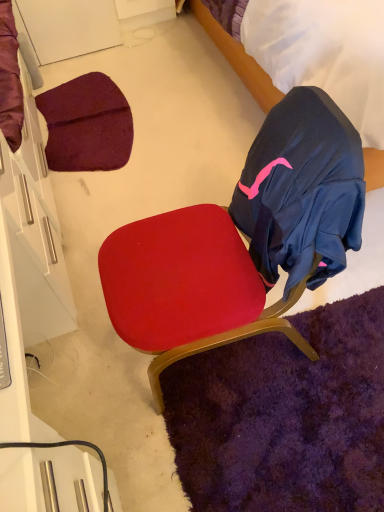
Question: Is velvet blue bed at upper right next to velvet red chair at center?

Choices:
 (A) yes
 (B) no

Answer: (B)

Question: From a real-world perspective, is velvet blue bed at upper right positioned under velvet red chair at center based on gravity?

Choices:
 (A) no
 (B) yes

Answer: (A)

Question: Considering the relative positions of velvet blue bed at upper right and velvet red chair at center in the image provided, is velvet blue bed at upper right to the right of velvet red chair at center from the viewer's perspective?

Choices:
 (A) no
 (B) yes

Answer: (B)

Question: Can you confirm if velvet blue bed at upper right is shorter than velvet red chair at center?

Choices:
 (A) yes
 (B) no

Answer: (B)

Question: From the image's perspective, is velvet blue bed at upper right over velvet red chair at center?

Choices:
 (A) no
 (B) yes

Answer: (B)

Question: Is velvet blue bed at upper right positioned in front of velvet red chair at center?

Choices:
 (A) no
 (B) yes

Answer: (A)

Question: Is the depth of velvet red chair at center greater than that of velvet blue bed at upper right?

Choices:
 (A) yes
 (B) no

Answer: (B)

Question: Could you tell me if velvet red chair at center is turned towards velvet blue bed at upper right?

Choices:
 (A) yes
 (B) no

Answer: (B)

Question: Can you confirm if velvet red chair at center is positioned to the right of velvet blue bed at upper right?

Choices:
 (A) no
 (B) yes

Answer: (A)

Question: Considering the relative positions of velvet red chair at center and velvet blue bed at upper right in the image provided, is velvet red chair at center in front of velvet blue bed at upper right?

Choices:
 (A) no
 (B) yes

Answer: (B)

Question: Is velvet red chair at center oriented away from velvet blue bed at upper right?

Choices:
 (A) yes
 (B) no

Answer: (B)

Question: Is velvet red chair at center placed right next to velvet blue bed at upper right?

Choices:
 (A) no
 (B) yes

Answer: (A)

Question: From the image's perspective, is velvet red chair at center above or below velvet blue bed at upper right?

Choices:
 (A) above
 (B) below

Answer: (B)